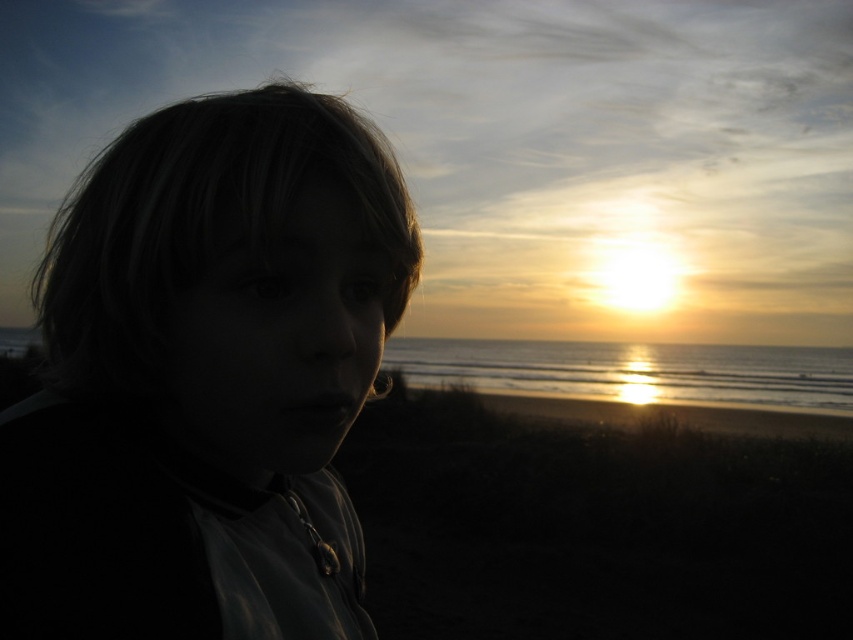
Question: Does matte black hair at left appear on the left side of glistening silver water at center?

Choices:
 (A) no
 (B) yes

Answer: (B)

Question: Does matte black hair at left have a smaller size compared to glistening silver water at center?

Choices:
 (A) no
 (B) yes

Answer: (B)

Question: Observing the image, what is the correct spatial positioning of matte black hair at left in reference to glistening silver water at center?

Choices:
 (A) below
 (B) above

Answer: (B)

Question: Which object appears farthest from the camera in this image?

Choices:
 (A) matte black hair at left
 (B) glistening silver water at center

Answer: (B)